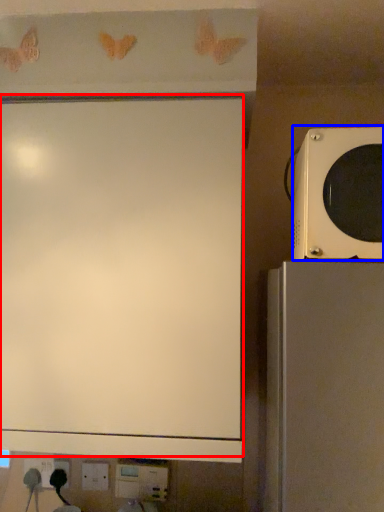
Question: Which point is further to the camera, projection screen (highlighted by a red box) or microwave oven (highlighted by a blue box)?

Choices:
 (A) projection screen
 (B) microwave oven

Answer: (A)